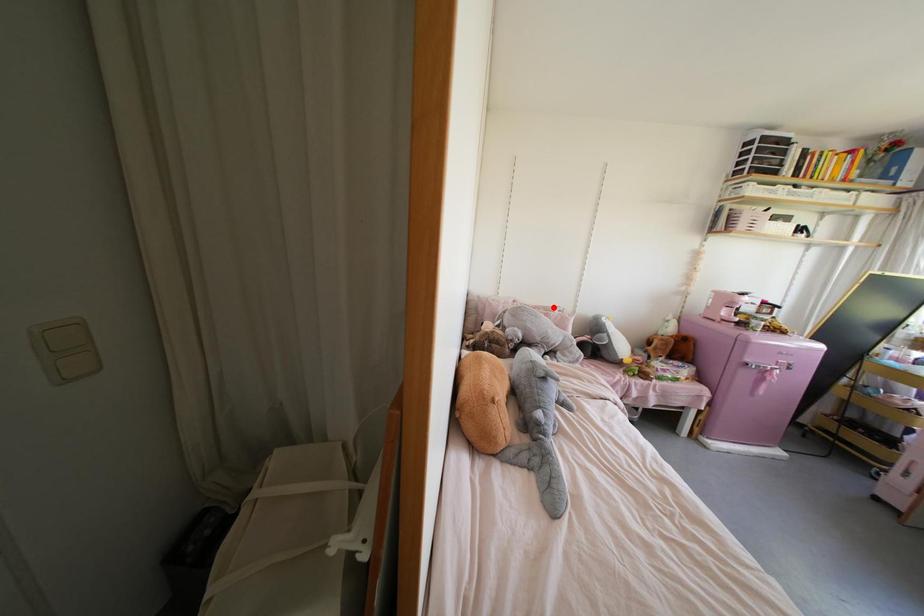
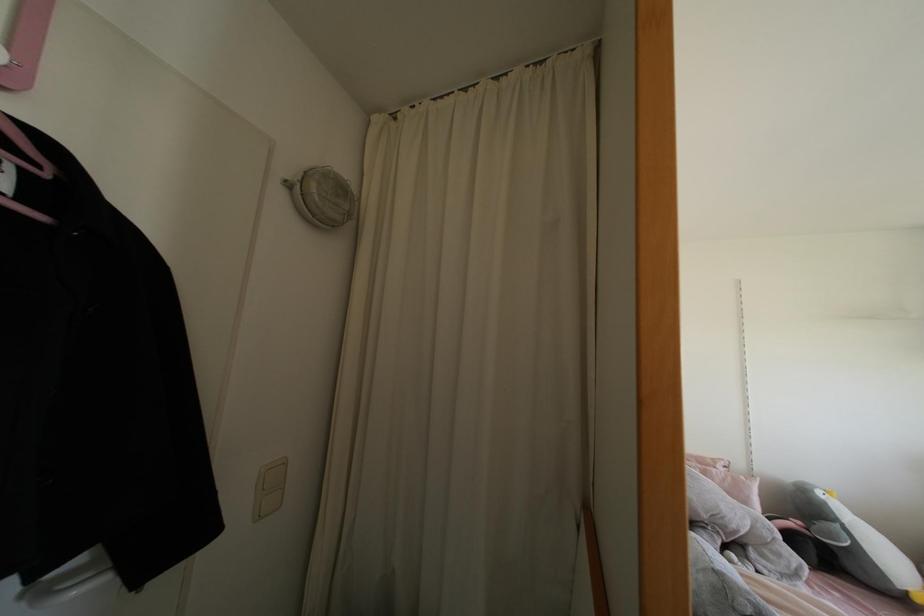
The point at the highlighted location is marked in the first image. Where is the corresponding point in the second image?

(712, 460)